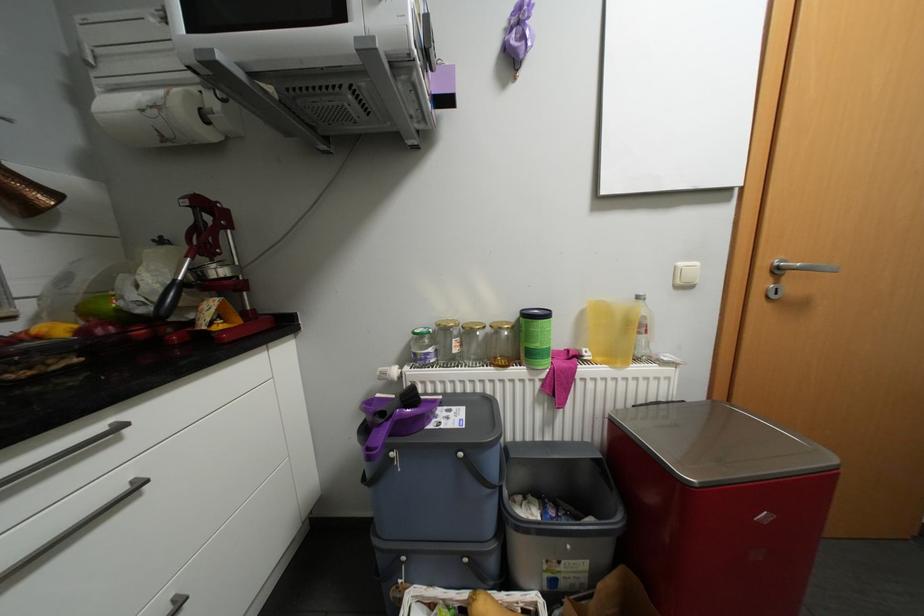
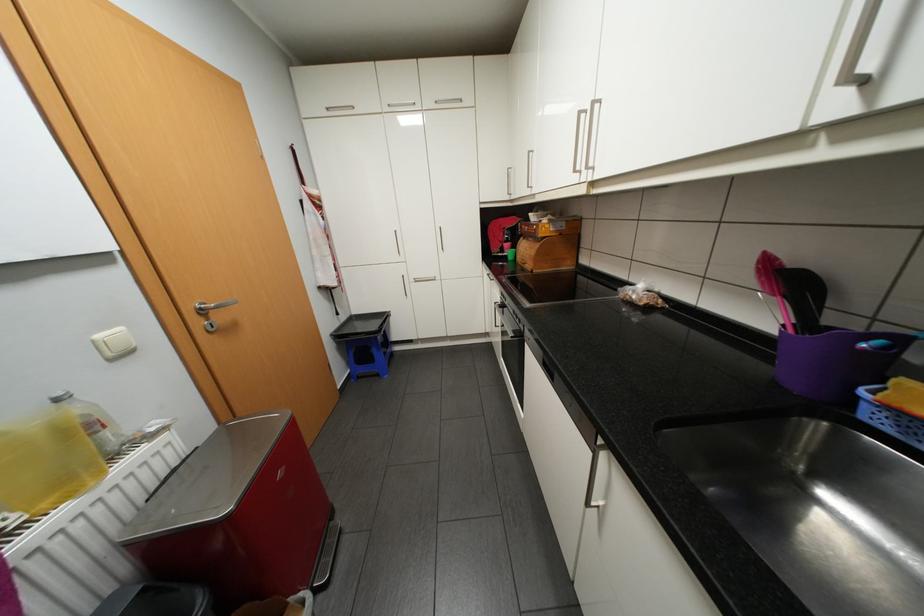
Where in the second image is the point corresponding to point (784, 265) from the first image?

(209, 308)